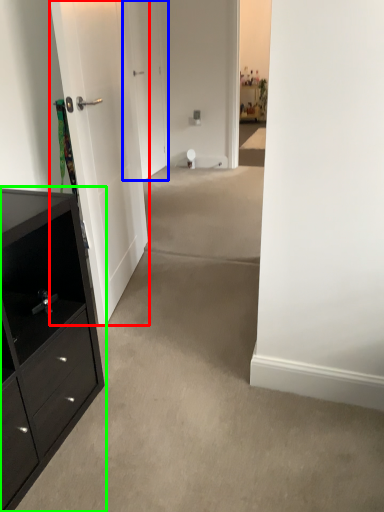
Question: Based on their relative distances, which object is farther from door (highlighted by a red box)? Choose from door (highlighted by a blue box) and chest of drawers (highlighted by a green box).

Choices:
 (A) door
 (B) chest of drawers

Answer: (A)